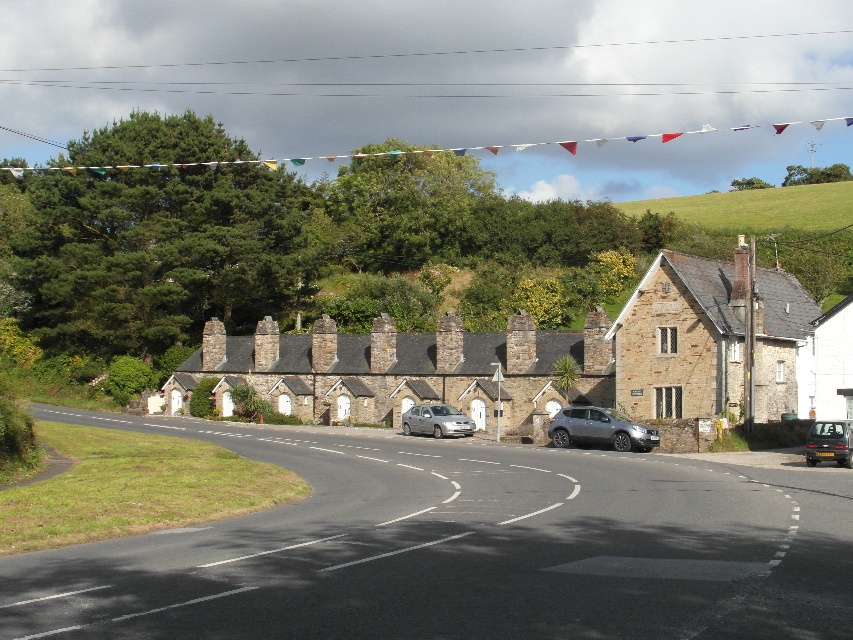
Does green grassy hillside at upper right have a greater width compared to silver metallic van at center?

Yes, green grassy hillside at upper right is wider than silver metallic van at center.

The height and width of the screenshot is (640, 853). I want to click on green grassy hillside at upper right, so click(758, 208).

Image resolution: width=853 pixels, height=640 pixels. What do you see at coordinates (758, 208) in the screenshot?
I see `green grassy hillside at upper right` at bounding box center [758, 208].

At what (x,y) coordinates should I click in order to perform the action: click on green grassy hillside at upper right. Please return your answer as a coordinate pair (x, y). The image size is (853, 640). Looking at the image, I should click on (758, 208).

Locate an element on the screen. green grassy hillside at upper right is located at coordinates (758, 208).

Is green grassy hillside at upper right wider than metallic silver car at lower right?

Yes, green grassy hillside at upper right is wider than metallic silver car at lower right.

Find the location of a particular element. The width and height of the screenshot is (853, 640). green grassy hillside at upper right is located at coordinates (758, 208).

Is point (567, 412) closer to viewer compared to point (451, 422)?

Yes, point (567, 412) is closer to viewer.

This screenshot has width=853, height=640. Find the location of `satin silver car at lower right`. satin silver car at lower right is located at coordinates (601, 428).

You are a GUI agent. You are given a task and a screenshot of the screen. Output one action in this format:
    pyautogui.click(x=<x>, y=<y>)
    Task: Click on the satin silver car at lower right
    The image size is (853, 640).
    Given the screenshot: What is the action you would take?
    pyautogui.click(x=601, y=428)

What are the coordinates of `satin silver car at lower right` in the screenshot? It's located at (601, 428).